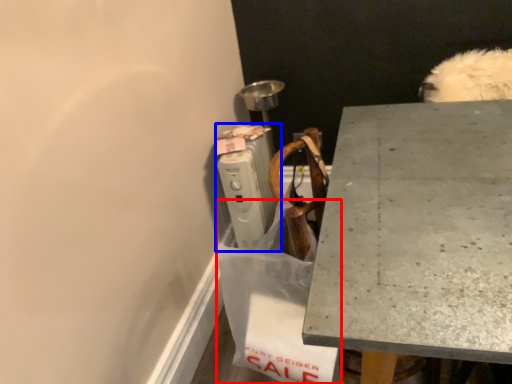
Question: Among these objects, which one is farthest to the camera, shopping bag (highlighted by a red box) or radiator (highlighted by a blue box)?

Choices:
 (A) shopping bag
 (B) radiator

Answer: (B)